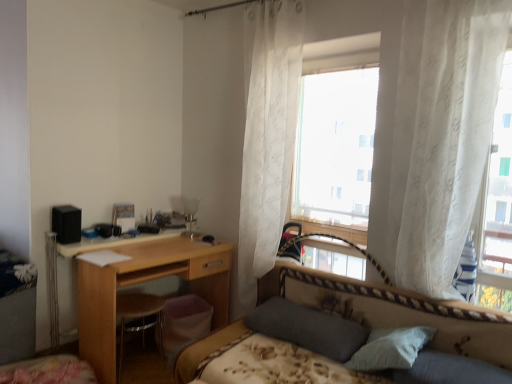
Question: Can you confirm if white sheer curtain at center, the 1th curtain viewed from the back, is positioned to the left of white sheer curtains at upper center, which ranks as the first window in back-to-front order?

Choices:
 (A) yes
 (B) no

Answer: (A)

Question: Does white sheer curtain at center, positioned as the first curtain in left-to-right order, have a lesser height compared to white sheer curtains at upper center, which ranks as the first window in back-to-front order?

Choices:
 (A) yes
 (B) no

Answer: (B)

Question: Is white sheer curtain at center, which appears as the second curtain when viewed from the front, with white sheer curtains at upper center, the 2th window from the right?

Choices:
 (A) yes
 (B) no

Answer: (B)

Question: Is white sheer curtain at center, positioned as the first curtain in left-to-right order, positioned beyond the bounds of white sheer curtains at upper center, which is counted as the 1th window, starting from the left?

Choices:
 (A) yes
 (B) no

Answer: (A)

Question: Can you confirm if white sheer curtain at center, which appears as the second curtain when viewed from the front, is smaller than white sheer curtains at upper center, which ranks as the first window in back-to-front order?

Choices:
 (A) no
 (B) yes

Answer: (B)

Question: Is point (476, 355) positioned closer to the camera than point (266, 319)?

Choices:
 (A) closer
 (B) farther

Answer: (A)

Question: From their relative heights in the image, would you say floral-patterned fabric bed at center is taller or shorter than dark gray plush pillow at center?

Choices:
 (A) short
 (B) tall

Answer: (B)

Question: Is floral-patterned fabric bed at center to the left or to the right of dark gray plush pillow at center in the image?

Choices:
 (A) right
 (B) left

Answer: (A)

Question: Considering their positions, is floral-patterned fabric bed at center located in front of or behind dark gray plush pillow at center?

Choices:
 (A) front
 (B) behind

Answer: (A)

Question: Looking at the image, does white sheer curtain at upper right, placed as the first curtain when sorted from front to back, seem bigger or smaller compared to floral-patterned fabric bed at center?

Choices:
 (A) small
 (B) big

Answer: (A)

Question: Looking at their shapes, would you say white sheer curtain at upper right, which is the first curtain from right to left, is wider or thinner than floral-patterned fabric bed at center?

Choices:
 (A) thin
 (B) wide

Answer: (A)

Question: Relative to floral-patterned fabric bed at center, is white sheer curtain at upper right, placed as the first curtain when sorted from front to back, in front or behind?

Choices:
 (A) front
 (B) behind

Answer: (B)

Question: From the image's perspective, relative to floral-patterned fabric bed at center, is white sheer curtain at upper right, which is the first curtain from right to left, above or below?

Choices:
 (A) below
 (B) above

Answer: (B)

Question: Considering the positions of floral-patterned fabric bed at center and wooden desk at center in the image, is floral-patterned fabric bed at center taller or shorter than wooden desk at center?

Choices:
 (A) short
 (B) tall

Answer: (A)

Question: From the image's perspective, is floral-patterned fabric bed at center above or below wooden desk at center?

Choices:
 (A) above
 (B) below

Answer: (B)